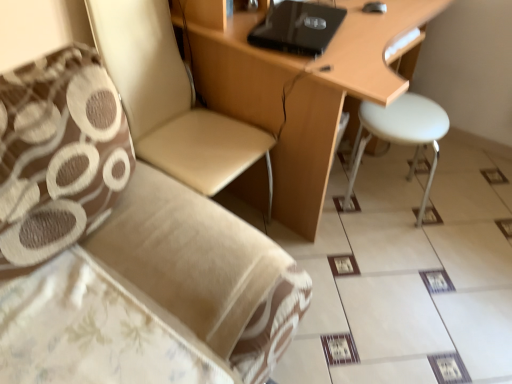
Question: From a real-world perspective, is beige fabric chair at upper left under brown textured pillow at left?

Choices:
 (A) no
 (B) yes

Answer: (B)

Question: Does beige fabric chair at upper left come behind brown textured pillow at left?

Choices:
 (A) yes
 (B) no

Answer: (A)

Question: Is beige fabric chair at upper left bigger than brown textured pillow at left?

Choices:
 (A) no
 (B) yes

Answer: (B)

Question: Is beige fabric chair at upper left to the right of brown textured pillow at left from the viewer's perspective?

Choices:
 (A) yes
 (B) no

Answer: (A)

Question: From the image's perspective, does beige fabric chair at upper left appear higher than brown textured pillow at left?

Choices:
 (A) yes
 (B) no

Answer: (A)

Question: Considering the relative sizes of beige fabric chair at upper left and brown textured pillow at left in the image provided, is beige fabric chair at upper left wider than brown textured pillow at left?

Choices:
 (A) yes
 (B) no

Answer: (A)

Question: From the image's perspective, is beige fabric chair at upper left beneath white plastic stool at right?

Choices:
 (A) no
 (B) yes

Answer: (A)

Question: From a real-world perspective, is beige fabric chair at upper left positioned under white plastic stool at right based on gravity?

Choices:
 (A) no
 (B) yes

Answer: (A)

Question: Does beige fabric chair at upper left have a lesser width compared to white plastic stool at right?

Choices:
 (A) yes
 (B) no

Answer: (B)

Question: Is beige fabric chair at upper left to the right of white plastic stool at right from the viewer's perspective?

Choices:
 (A) no
 (B) yes

Answer: (A)

Question: Is beige fabric chair at upper left positioned before white plastic stool at right?

Choices:
 (A) yes
 (B) no

Answer: (A)

Question: Can you confirm if beige fabric chair at upper left is smaller than white plastic stool at right?

Choices:
 (A) no
 (B) yes

Answer: (A)

Question: Does white plastic stool at right have a larger size compared to black matte laptop at upper center?

Choices:
 (A) yes
 (B) no

Answer: (A)